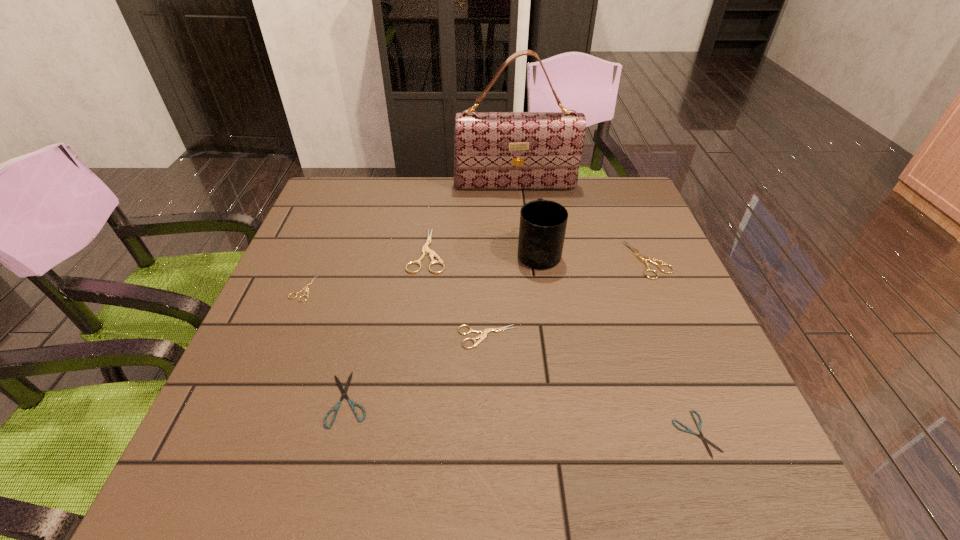
You are a GUI agent. You are given a task and a screenshot of the screen. Output one action in this format:
    pyautogui.click(x=<x>, y=<y>)
    Task: Click on the vacant area situated on the right of the second beige shears from left to right
    
    Given the screenshot: What is the action you would take?
    pyautogui.click(x=587, y=251)

In order to click on vacant space located 0.130m on the left of the second biggest beige shears in this screenshot , I will do `click(576, 260)`.

This screenshot has height=540, width=960. I want to click on free space located on the back of the fourth shortest shears, so click(x=486, y=278).

Where is `free space located on the back of the leftmost beige shears`? The image size is (960, 540). free space located on the back of the leftmost beige shears is located at coordinates (323, 241).

Find the location of a particular element. vacant point located on the right of the left black shears is located at coordinates (413, 399).

This screenshot has height=540, width=960. I want to click on vacant space located 0.370m on the left of the shortest object, so click(463, 434).

Image resolution: width=960 pixels, height=540 pixels. Identify the location of object present at the far edge. (492, 150).

Where is `object that is at the near edge`? object that is at the near edge is located at coordinates (688, 430).

At what (x,y) coordinates should I click in order to perform the action: click on object that is at the left edge. Please return your answer as a coordinate pair (x, y). Looking at the image, I should click on (305, 287).

I want to click on object situated at the near right corner, so click(x=688, y=430).